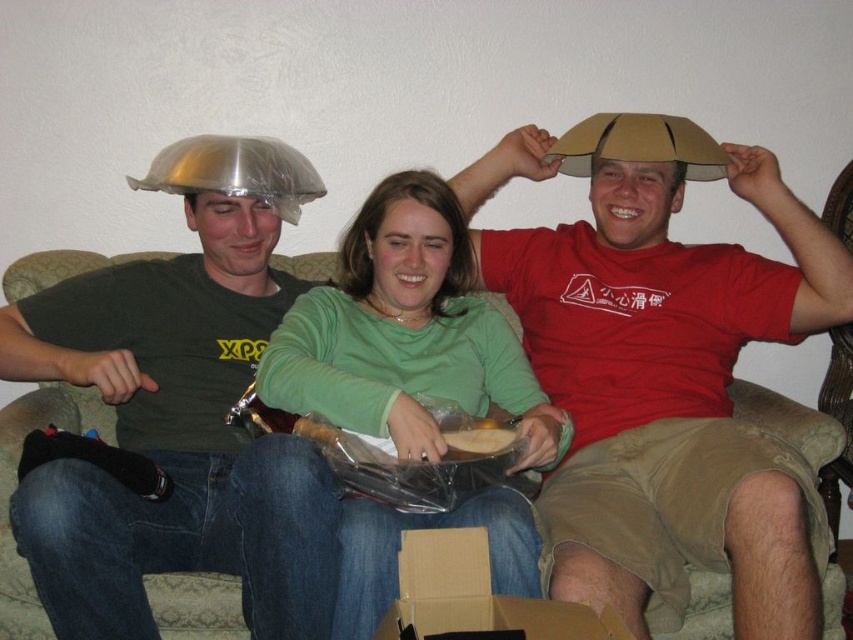
You are trying to decide which object is wider between the matte cardboard hat at upper center and the matte black shirt at left. Based on the scene, can you determine which one is wider?

The matte cardboard hat at upper center might be wider than matte black shirt at left according to the description.

You are organizing a party and need to decide which item to use as a helmet for a game. Based on the image, which item between the matte cardboard hat at upper center and the cardboard box at lower center would be more suitable for covering the head?

The matte cardboard hat at upper center is bigger than the cardboard box at lower center, so it would be more suitable for covering the head as a helmet.

You are a photographer setting up for a group photo. You notice the matte cardboard hat at upper center and the matte black shirt at left. Which object is positioned higher in the image?

The matte cardboard hat at upper center is located above the matte black shirt at left, so it is positioned higher in the image.